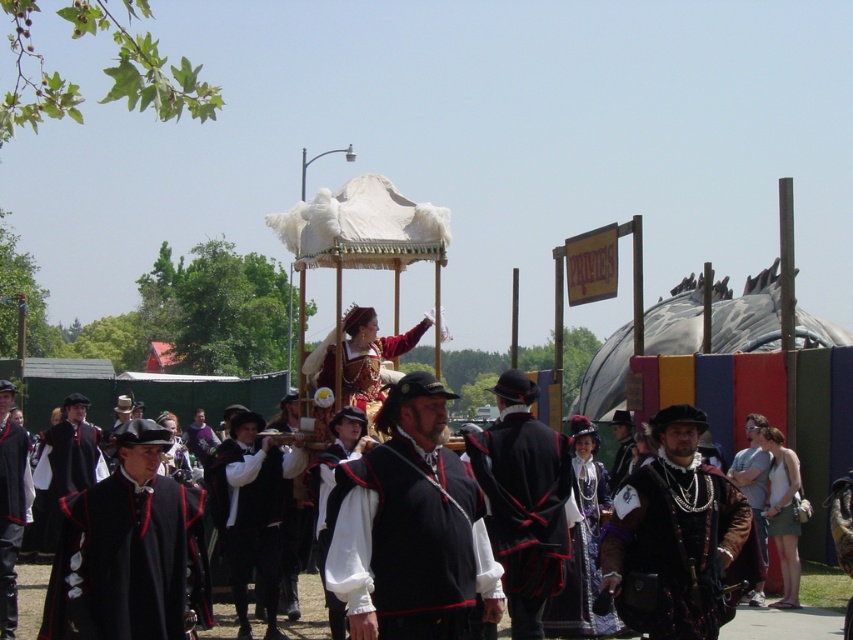
Which is above, matte black coat at center or white satin robe at center?

white satin robe at center

At what (x,y) coordinates should I click in order to perform the action: click on matte black coat at center. Please return your answer as a coordinate pair (x, y). Image resolution: width=853 pixels, height=640 pixels. Looking at the image, I should click on (252, 509).

Find the location of a particular element. matte black coat at center is located at coordinates (252, 509).

The image size is (853, 640). What are the coordinates of `matte black vest at center` in the screenshot? It's located at (405, 524).

Which is in front, point (463, 550) or point (247, 577)?

Point (463, 550) is in front.

You are a GUI agent. You are given a task and a screenshot of the screen. Output one action in this format:
    pyautogui.click(x=<x>, y=<y>)
    Task: Click on the matte black vest at center
    
    Given the screenshot: What is the action you would take?
    pyautogui.click(x=405, y=524)

Is black velvet vest at center bigger than matte black robe at center?

No.

Does point (529, 552) come in front of point (83, 417)?

Yes, point (529, 552) is closer to viewer.

You are a GUI agent. You are given a task and a screenshot of the screen. Output one action in this format:
    pyautogui.click(x=<x>, y=<y>)
    Task: Click on the black velvet vest at center
    The image size is (853, 640).
    Given the screenshot: What is the action you would take?
    pyautogui.click(x=524, y=499)

Where is `black velvet vest at center`? black velvet vest at center is located at coordinates (524, 499).